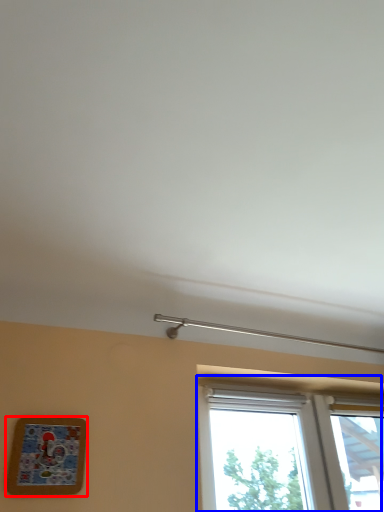
Question: Which object appears farthest to the camera in this image, picture frame (highlighted by a red box) or window (highlighted by a blue box)?

Choices:
 (A) picture frame
 (B) window

Answer: (B)